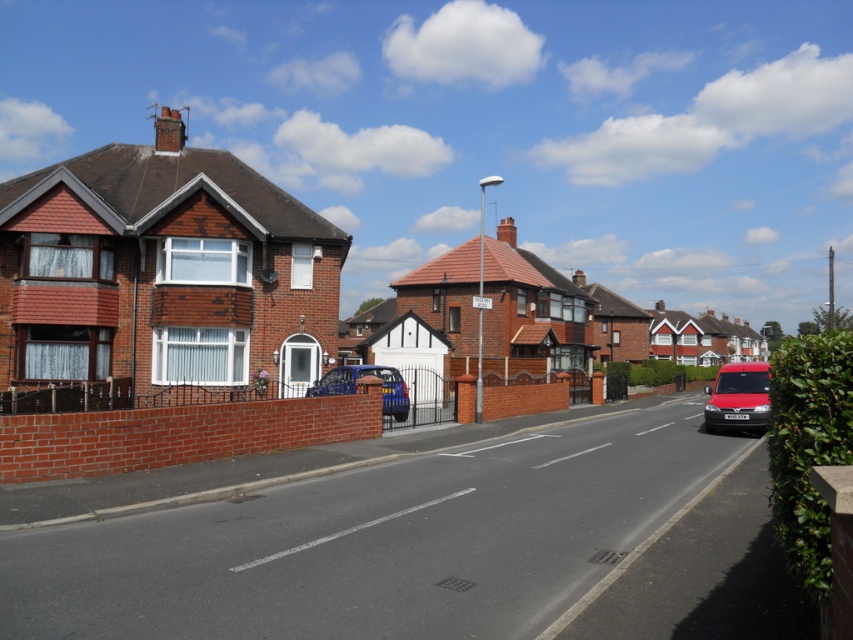
Looking at this image, you are a delivery driver who needs to park your truck on the smooth asphalt road at center. However, there is a metallic red van at right parked nearby. Can you park your truck without overlapping the van?

The smooth asphalt road at center is bigger than the metallic red van at right, so yes, you can park your truck on the smooth asphalt road at center without overlapping the metallic red van at right since there is enough space available.

You are driving a delivery truck and need to park in the residential area shown. You see a metallic red van at right and a metallic blue car at center. Which vehicle should you avoid parking next to if you want to leave more space for other vehicles?

The metallic red van at right is bigger than the metallic blue car at center, so parking next to the metallic red van at right would leave less space for other vehicles. Therefore, you should avoid parking next to the metallic red van at right.

You are standing at the center of the road in the residential street scene. You want to walk to the metallic red van at right. Which direction should you walk to reach it?

The metallic red van at right is located at point (738, 397), so you should walk towards the right side of the road to reach it.